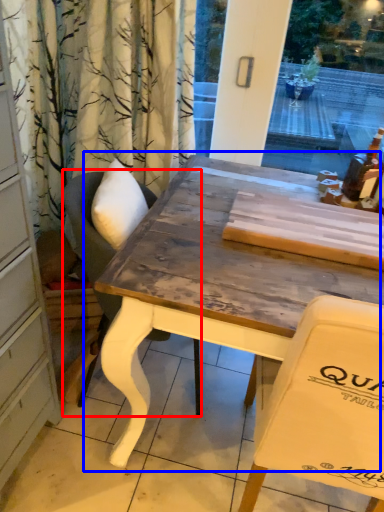
Question: Among these objects, which one is nearest to the camera, chair (highlighted by a red box) or table (highlighted by a blue box)?

Choices:
 (A) chair
 (B) table

Answer: (B)